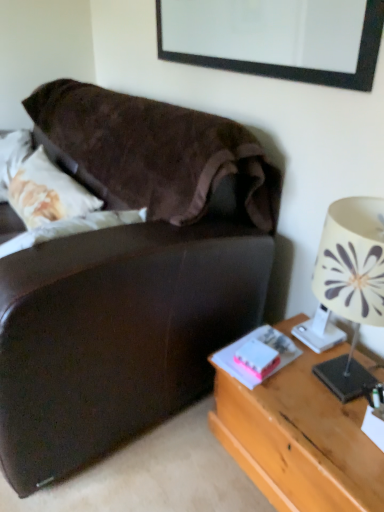
Question: From their relative heights in the image, would you say white fabric lampshade at right is taller or shorter than wooden desk at right?

Choices:
 (A) short
 (B) tall

Answer: (B)

Question: Does point (332, 229) appear closer or farther from the camera than point (266, 404)?

Choices:
 (A) closer
 (B) farther

Answer: (A)

Question: Considering the real-world distances, which object is closest to the pink matte book at lower right, which ranks as the first book in right-to-left order?

Choices:
 (A) white fabric lampshade at right
 (B) white matte book at lower right, the 1th book viewed from the left
 (C) black matte picture frame at upper center
 (D) wooden desk at right

Answer: (B)

Question: Estimate the real-world distances between objects in this image. Which object is farther from the white fabric lampshade at right?

Choices:
 (A) pink matte book at lower right, which ranks as the first book in right-to-left order
 (B) white matte book at lower right, the 1th book viewed from the left
 (C) black matte picture frame at upper center
 (D) wooden desk at right

Answer: (C)